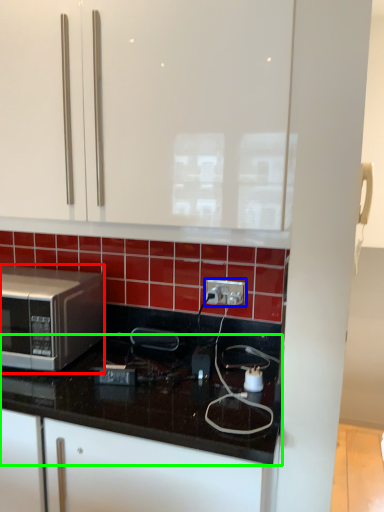
Question: Based on their relative distances, which object is nearer to microwave oven (highlighted by a red box)? Choose from electric outlet (highlighted by a blue box) and countertop (highlighted by a green box).

Choices:
 (A) electric outlet
 (B) countertop

Answer: (B)